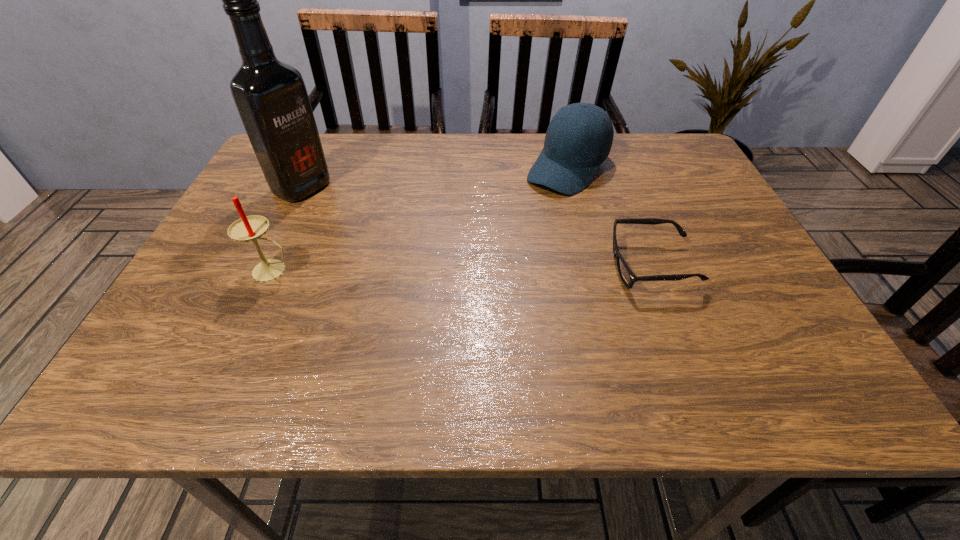
What are the coordinates of `candle` in the screenshot? It's located at (247, 228).

This screenshot has width=960, height=540. I want to click on sunglasses, so click(627, 276).

The height and width of the screenshot is (540, 960). What are the coordinates of `the tallest object` in the screenshot? It's located at (271, 97).

Locate an element on the screen. baseball cap is located at coordinates (572, 152).

The image size is (960, 540). Identify the location of free space located 0.300m on the right of the third shortest object. (442, 271).

Locate an element on the screen. The image size is (960, 540). free point located on the front-facing side of the sunglasses is located at coordinates (558, 266).

At what (x,y) coordinates should I click in order to perform the action: click on vacant space positioned on the front-facing side of the sunglasses. Please return your answer as a coordinate pair (x, y). The image size is (960, 540). Looking at the image, I should click on (466, 266).

The height and width of the screenshot is (540, 960). I want to click on vacant space located on the front-facing side of the sunglasses, so click(558, 266).

At what (x,y) coordinates should I click in order to perform the action: click on vacant point located on the front-facing side of the tallest object. Please return your answer as a coordinate pair (x, y). Looking at the image, I should click on 353,212.

Locate an element on the screen. Image resolution: width=960 pixels, height=540 pixels. vacant space located on the front-facing side of the tallest object is located at coordinates click(448, 256).